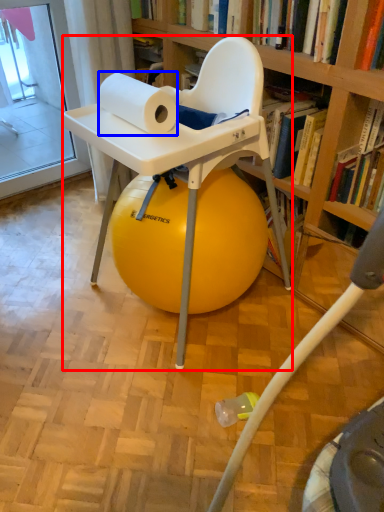
Question: Among these objects, which one is nearest to the camera, chair (highlighted by a red box) or paper towel (highlighted by a blue box)?

Choices:
 (A) chair
 (B) paper towel

Answer: (B)